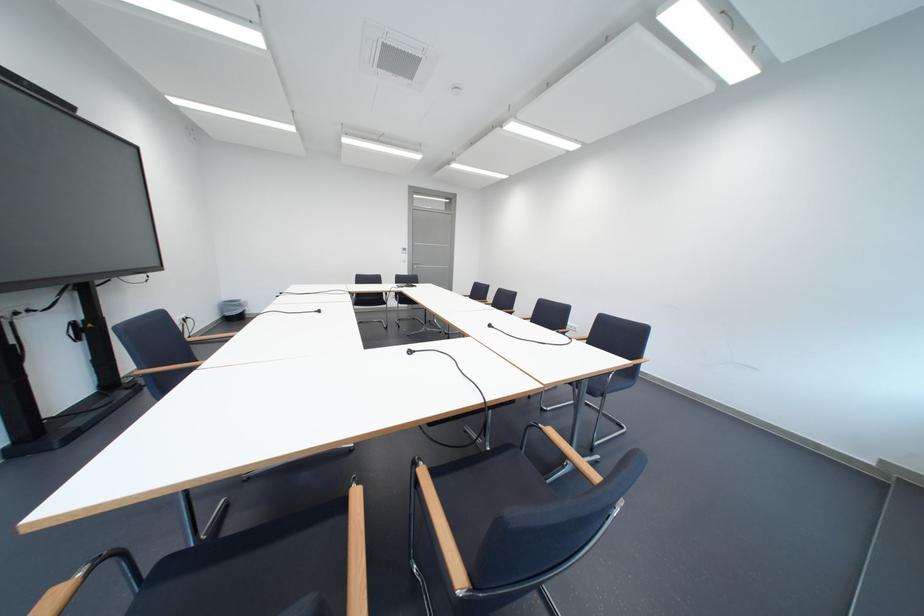
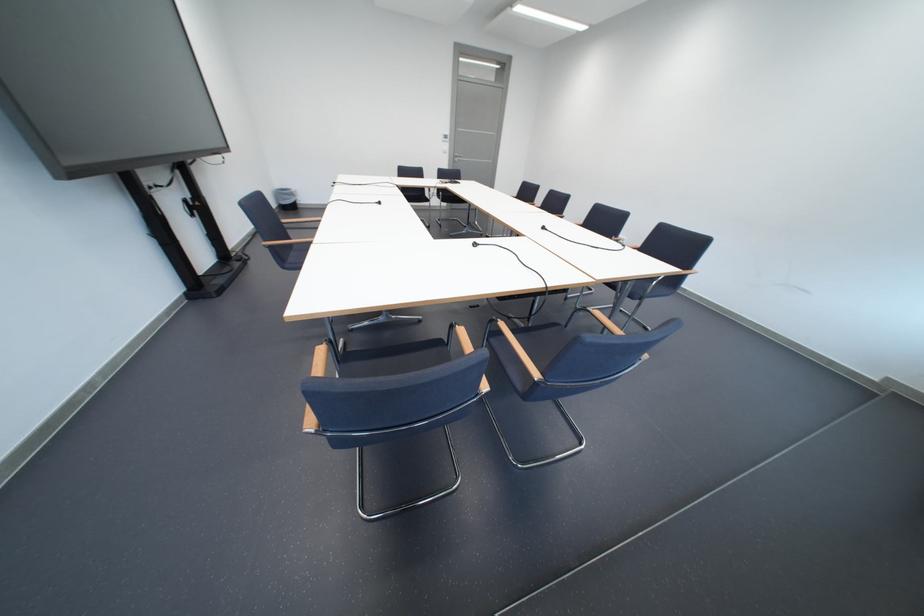
Question: The first image is from the beginning of the video and the second image is from the end. How did the camera likely rotate when shooting the video?

Choices:
 (A) Left
 (B) Right
 (C) Up
 (D) Down

Answer: (D)